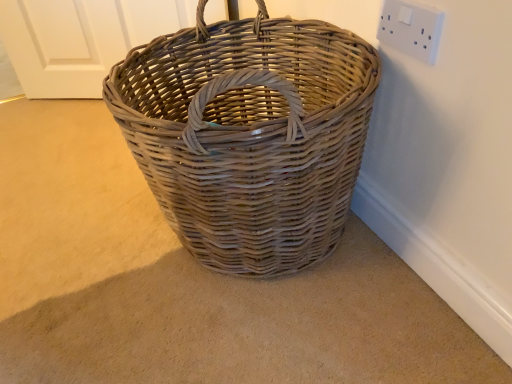
Find the location of a particular element. The image size is (512, 384). vacant area that lies in front of natural wicker picnic basket at center is located at coordinates (275, 337).